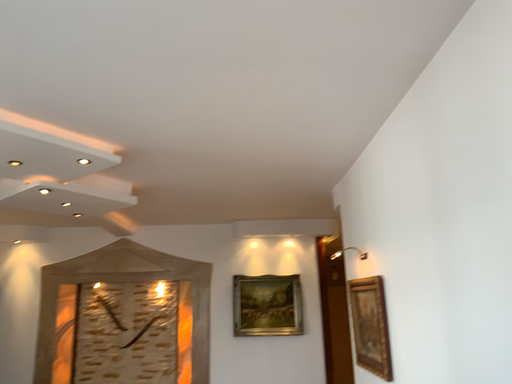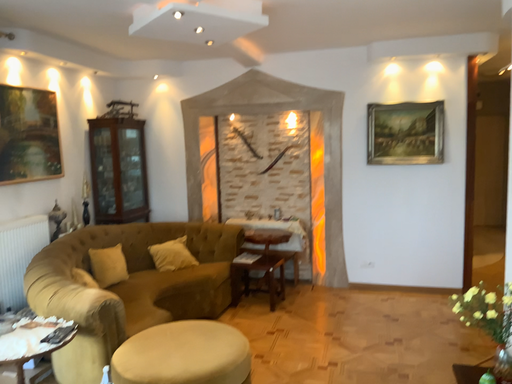
Question: Which way did the camera rotate in the video?

Choices:
 (A) rotated downward
 (B) rotated upward

Answer: (A)